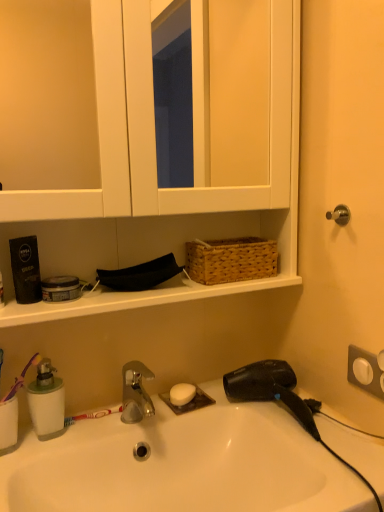
Question: Considering the relative positions of white matte medicine cabinet at upper center and green translucent soap dispenser at lower left in the image provided, is white matte medicine cabinet at upper center to the right of green translucent soap dispenser at lower left from the viewer's perspective?

Choices:
 (A) no
 (B) yes

Answer: (B)

Question: Are white matte medicine cabinet at upper center and green translucent soap dispenser at lower left far apart?

Choices:
 (A) no
 (B) yes

Answer: (A)

Question: Can you confirm if white matte medicine cabinet at upper center is positioned to the left of green translucent soap dispenser at lower left?

Choices:
 (A) yes
 (B) no

Answer: (B)

Question: Is white matte medicine cabinet at upper center thinner than green translucent soap dispenser at lower left?

Choices:
 (A) yes
 (B) no

Answer: (B)

Question: Is white matte medicine cabinet at upper center surrounding green translucent soap dispenser at lower left?

Choices:
 (A) no
 (B) yes

Answer: (A)

Question: Considering the positions of white matte medicine cabinet at upper center and white matte soap at center in the image, is white matte medicine cabinet at upper center taller or shorter than white matte soap at center?

Choices:
 (A) tall
 (B) short

Answer: (A)

Question: From a real-world perspective, relative to white matte soap at center, is white matte medicine cabinet at upper center vertically above or below?

Choices:
 (A) above
 (B) below

Answer: (A)

Question: Considering the positions of point (283, 126) and point (177, 397), is point (283, 126) closer or farther from the camera than point (177, 397)?

Choices:
 (A) farther
 (B) closer

Answer: (B)

Question: From the image's perspective, is white matte medicine cabinet at upper center positioned above or below white matte soap at center?

Choices:
 (A) below
 (B) above

Answer: (B)

Question: Looking at their shapes, would you say purple plastic toothbrush at left is wider or thinner than woven brown basket at upper center?

Choices:
 (A) thin
 (B) wide

Answer: (A)

Question: Is point (34, 356) positioned closer to the camera than point (253, 240)?

Choices:
 (A) closer
 (B) farther

Answer: (A)

Question: From a real-world perspective, is purple plastic toothbrush at left physically located above or below woven brown basket at upper center?

Choices:
 (A) above
 (B) below

Answer: (B)

Question: Visually, is purple plastic toothbrush at left positioned to the left or to the right of woven brown basket at upper center?

Choices:
 (A) right
 (B) left

Answer: (B)

Question: Based on their sizes in the image, would you say white matte soap at center is bigger or smaller than white matte medicine cabinet at upper center?

Choices:
 (A) small
 (B) big

Answer: (A)

Question: Based on their positions, is white matte soap at center located to the left or right of white matte medicine cabinet at upper center?

Choices:
 (A) right
 (B) left

Answer: (A)